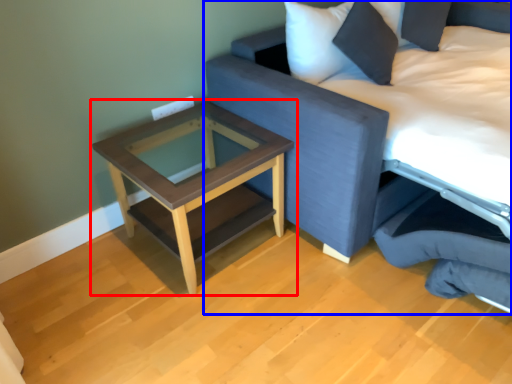
Question: Which of the following is the closest to the observer, table (highlighted by a red box) or studio couch (highlighted by a blue box)?

Choices:
 (A) table
 (B) studio couch

Answer: (B)